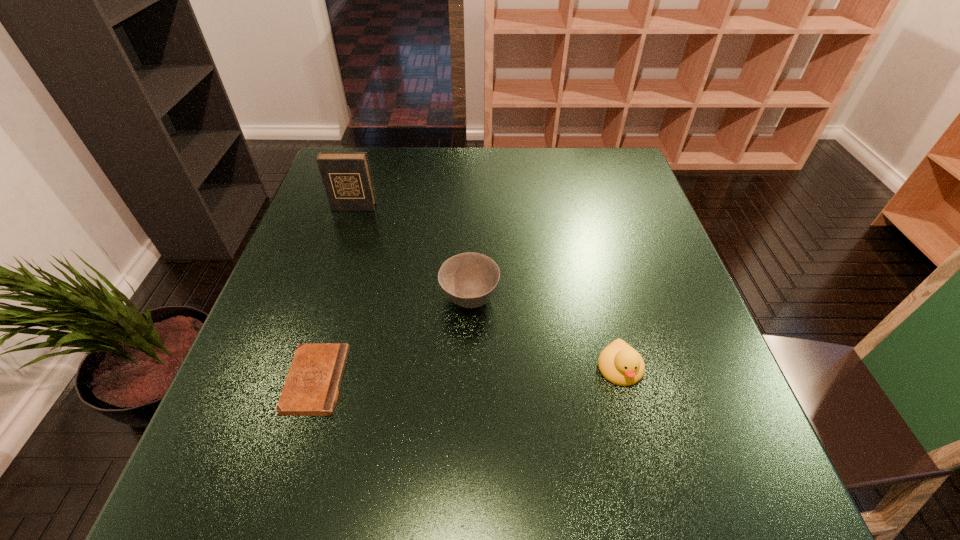
At what (x,y) coordinates should I click in order to perform the action: click on the farther diary. Please return your answer as a coordinate pair (x, y). Looking at the image, I should click on (346, 176).

Identify the location of the taller diary. (346, 176).

Locate an element on the screen. the third nearest object is located at coordinates (469, 280).

Locate an element on the screen. This screenshot has height=540, width=960. the second object from right to left is located at coordinates (469, 280).

Where is `duckling`? This screenshot has width=960, height=540. duckling is located at coordinates (619, 363).

This screenshot has width=960, height=540. Find the location of `the shortest object`. the shortest object is located at coordinates (312, 386).

You are a GUI agent. You are given a task and a screenshot of the screen. Output one action in this format:
    pyautogui.click(x=<x>, y=<y>)
    Task: Click on the nearer diary
    Image resolution: width=960 pixels, height=540 pixels.
    Given the screenshot: What is the action you would take?
    pyautogui.click(x=312, y=386)

You are a GUI agent. You are given a task and a screenshot of the screen. Output one action in this format:
    pyautogui.click(x=<x>, y=<y>)
    Task: Click on the free space located on the front cover of the taller diary
    Image resolution: width=960 pixels, height=540 pixels.
    Given the screenshot: What is the action you would take?
    pyautogui.click(x=340, y=248)

In order to click on vacant space located 0.150m on the front of the bowl in this screenshot , I will do `click(468, 385)`.

Locate an element on the screen. The height and width of the screenshot is (540, 960). vacant region located on the face of the duckling is located at coordinates (640, 450).